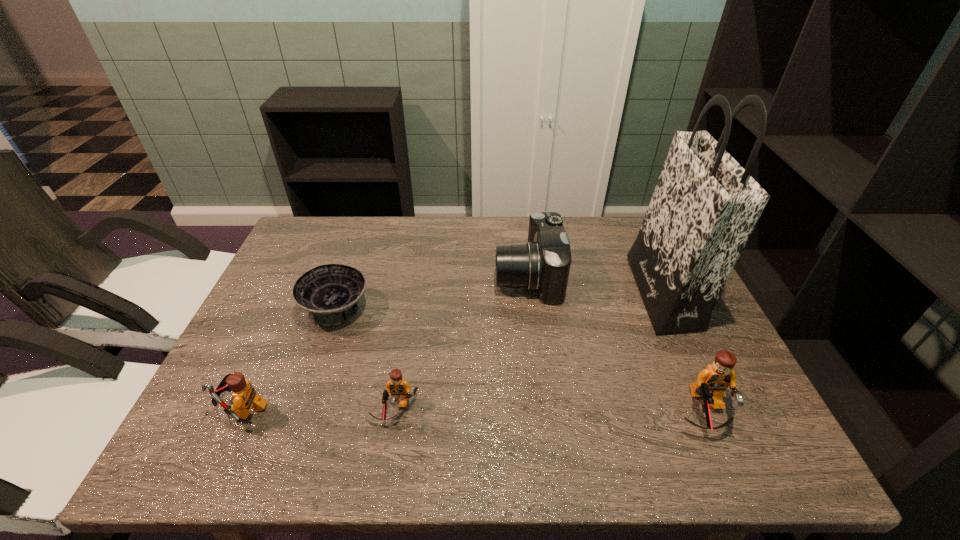
If equal spacing is desired by inserting an extra Lego among them, please point out a free spot for this new Lego. Please provide its 2D coordinates. Your answer should be formatted as a tuple, i.e. [(x, y)], where the tuple contains the x and y coordinates of a point satisfying the conditions above.

[(549, 411)]